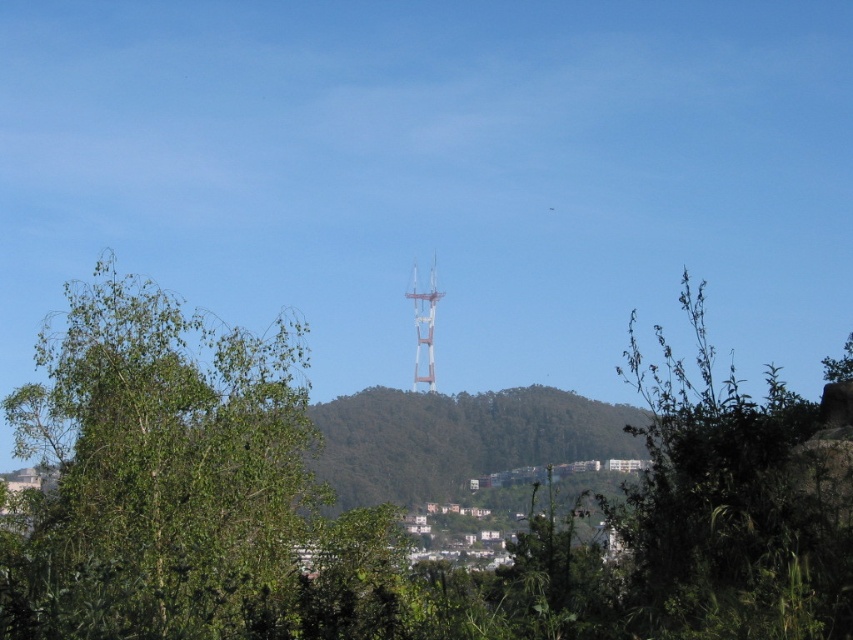
Question: Is green leafy tree at center closer to the viewer compared to metallic silver tower at center?

Choices:
 (A) yes
 (B) no

Answer: (A)

Question: Can you confirm if green leafy tree at center is positioned to the left of green leafy bush at center?

Choices:
 (A) yes
 (B) no

Answer: (A)

Question: Estimate the real-world distances between objects in this image. Which object is farther from the metallic silver tower at center?

Choices:
 (A) green leafy bush at center
 (B) green leafy tree at center

Answer: (A)

Question: Does green leafy tree at center have a smaller size compared to green leafy bush at center?

Choices:
 (A) yes
 (B) no

Answer: (B)

Question: Which of the following is the closest to the observer?

Choices:
 (A) (192, 525)
 (B) (711, 627)
 (C) (430, 269)

Answer: (B)

Question: Which point is closer to the camera?

Choices:
 (A) (810, 403)
 (B) (166, 356)
 (C) (416, 355)

Answer: (A)